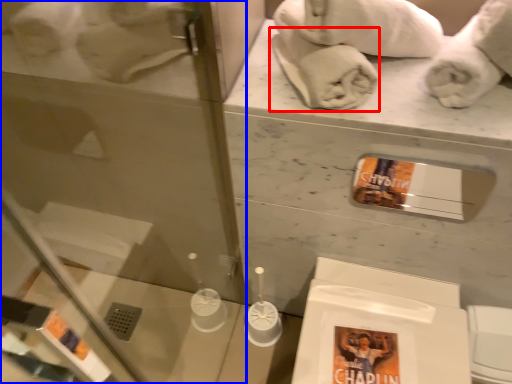
Question: Which object appears closest to the camera in this image, bath towel (highlighted by a red box) or glass door (highlighted by a blue box)?

Choices:
 (A) bath towel
 (B) glass door

Answer: (B)